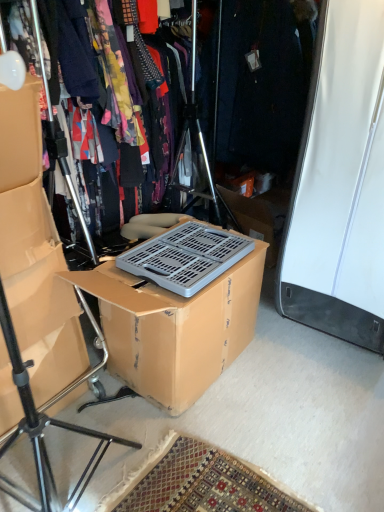
Question: Is matte cardboard box at left surrounding brown cardboard box at center?

Choices:
 (A) no
 (B) yes

Answer: (A)

Question: Is matte cardboard box at left shorter than brown cardboard box at center?

Choices:
 (A) no
 (B) yes

Answer: (A)

Question: Can you see matte cardboard box at left touching brown cardboard box at center?

Choices:
 (A) yes
 (B) no

Answer: (B)

Question: Is the depth of matte cardboard box at left less than that of brown cardboard box at center?

Choices:
 (A) yes
 (B) no

Answer: (A)

Question: Can you confirm if matte cardboard box at left is thinner than brown cardboard box at center?

Choices:
 (A) no
 (B) yes

Answer: (B)

Question: Considering the relative positions of matte cardboard box at left and brown cardboard box at center in the image provided, is matte cardboard box at left to the left of brown cardboard box at center from the viewer's perspective?

Choices:
 (A) yes
 (B) no

Answer: (A)

Question: From a real-world perspective, does matte black tripod at left sit lower than matte cardboard box at left?

Choices:
 (A) no
 (B) yes

Answer: (B)

Question: Would you say matte black tripod at left is outside matte cardboard box at left?

Choices:
 (A) yes
 (B) no

Answer: (A)

Question: Considering the relative positions of matte black tripod at left and matte cardboard box at left in the image provided, is matte black tripod at left in front of matte cardboard box at left?

Choices:
 (A) yes
 (B) no

Answer: (A)

Question: From a real-world perspective, is matte black tripod at left on matte cardboard box at left?

Choices:
 (A) yes
 (B) no

Answer: (B)

Question: Can you confirm if matte black tripod at left is positioned to the right of matte cardboard box at left?

Choices:
 (A) yes
 (B) no

Answer: (B)

Question: Does matte black tripod at left have a smaller size compared to matte cardboard box at left?

Choices:
 (A) yes
 (B) no

Answer: (B)

Question: Can you confirm if brown cardboard box at center is smaller than floral fabric dress at center?

Choices:
 (A) yes
 (B) no

Answer: (A)